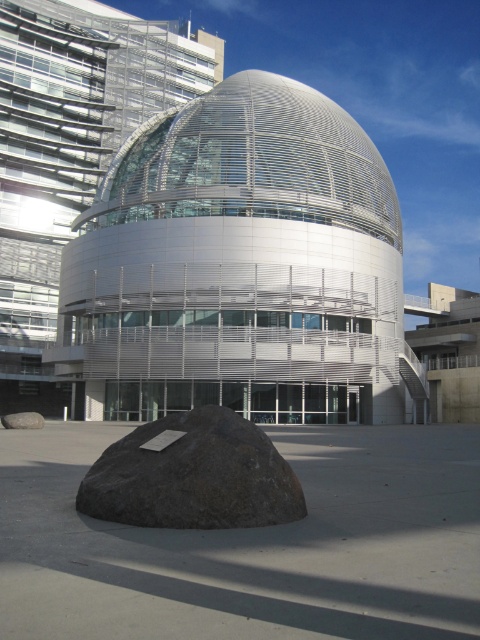
Question: Does white metallic dome at center have a greater width compared to gray rough rock at lower center?

Choices:
 (A) no
 (B) yes

Answer: (B)

Question: Which of the following is the farthest from the observer?

Choices:
 (A) (193, 131)
 (B) (260, 497)
 (C) (32, 417)

Answer: (A)

Question: Is dark gray stone boulder at lower center smaller than gray rough rock at lower center?

Choices:
 (A) no
 (B) yes

Answer: (B)

Question: Which point is farther to the camera?

Choices:
 (A) (33, 426)
 (B) (298, 497)
 (C) (351, 211)

Answer: (C)

Question: Estimate the real-world distances between objects in this image. Which object is closer to the gray rough rock at lower center?

Choices:
 (A) dark gray stone boulder at lower center
 (B) white metallic dome at center

Answer: (A)

Question: Does white metallic dome at center have a greater width compared to gray rough rock at lower center?

Choices:
 (A) no
 (B) yes

Answer: (B)